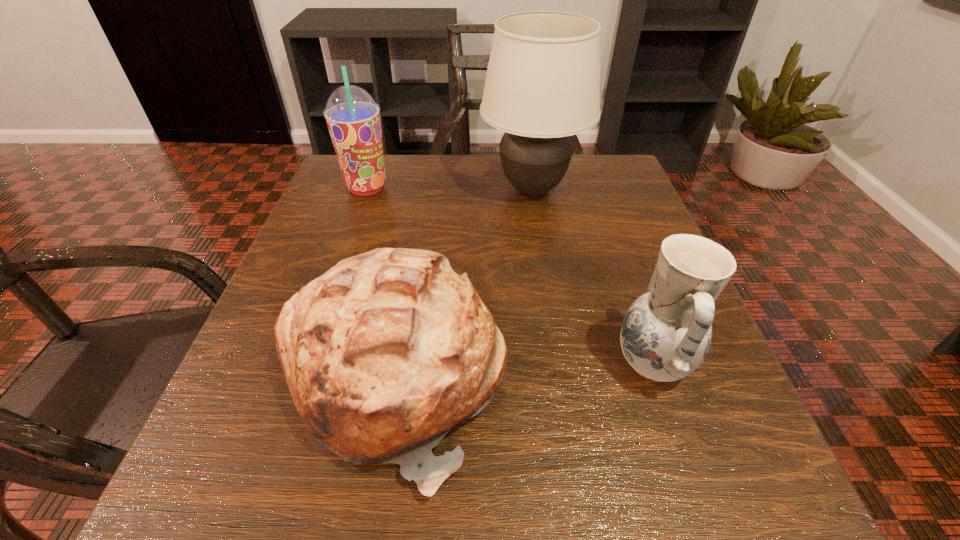
Locate an element on the screen. lampshade located in the far edge section of the desktop is located at coordinates (542, 86).

In order to click on smoothie that is at the far edge in this screenshot , I will do `click(353, 118)`.

Where is `object present at the near edge`? Image resolution: width=960 pixels, height=540 pixels. object present at the near edge is located at coordinates (386, 352).

At what (x,y) coordinates should I click in order to perform the action: click on smoothie present at the left edge. Please return your answer as a coordinate pair (x, y). Image resolution: width=960 pixels, height=540 pixels. Looking at the image, I should click on (353, 118).

Find the location of `bread that is at the left edge`. bread that is at the left edge is located at coordinates (386, 352).

Image resolution: width=960 pixels, height=540 pixels. In order to click on lampshade at the right edge in this screenshot , I will do `click(542, 86)`.

Where is `pottery that is at the right edge`? This screenshot has height=540, width=960. pottery that is at the right edge is located at coordinates (666, 333).

Locate an element on the screen. object present at the far left corner is located at coordinates (353, 118).

You are a GUI agent. You are given a task and a screenshot of the screen. Output one action in this format:
    pyautogui.click(x=<x>, y=<y>)
    Task: Click on the object that is at the near left corner
    
    Given the screenshot: What is the action you would take?
    pyautogui.click(x=386, y=352)

Identify the location of object that is at the far right corner. (542, 86).